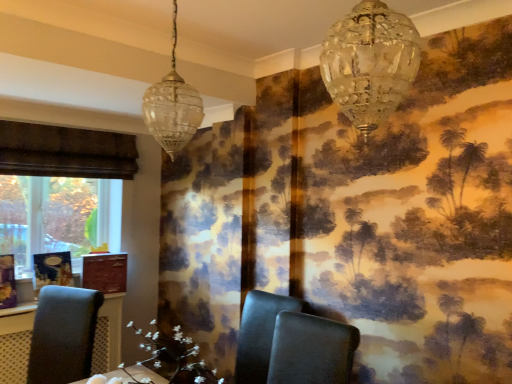
Question: Looking at the image, does clear glass pendant light at upper left, positioned as the 1th lamp in back-to-front order, seem bigger or smaller compared to black leather chair at center, the 2th chair viewed from the right?

Choices:
 (A) small
 (B) big

Answer: (A)

Question: In the image, is clear glass pendant light at upper left, the first lamp in the left-to-right sequence, positioned in front of or behind black leather chair at center, placed as the 2th chair when sorted from left to right?

Choices:
 (A) front
 (B) behind

Answer: (A)

Question: Which of these objects is positioned farthest from the matte black chair at left, the 1th chair in the left-to-right sequence?

Choices:
 (A) matte dark gray chair at center, the first chair from the right
 (B) black leather chair at center, the 2th chair viewed from the right
 (C) clear glass pendant light at upper left, the first lamp in the left-to-right sequence
 (D) white floral arrangement at center
 (E) crystal glass chandelier at upper center, which is counted as the first lamp, starting from the right

Answer: (E)

Question: Considering the real-world distances, which object is farthest from the crystal glass chandelier at upper center, placed as the 1th lamp when sorted from front to back?

Choices:
 (A) matte black chair at left, the 1th chair in the left-to-right sequence
 (B) black leather chair at center, placed as the 2th chair when sorted from left to right
 (C) clear glass pendant light at upper left, which ranks as the second lamp in right-to-left order
 (D) white floral arrangement at center
 (E) matte dark gray chair at center, the first chair from the right

Answer: (A)